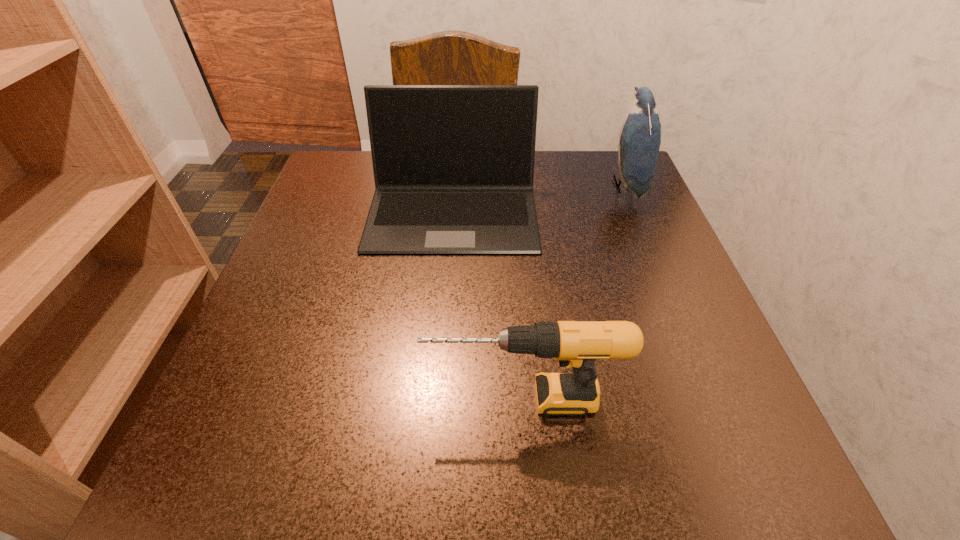
You are a GUI agent. You are given a task and a screenshot of the screen. Output one action in this format:
    pyautogui.click(x=<x>, y=<y>)
    Task: Click on the laptop
    The image size is (960, 540).
    Given the screenshot: What is the action you would take?
    pyautogui.click(x=453, y=165)

This screenshot has width=960, height=540. I want to click on the rightmost object, so click(640, 136).

I want to click on the shortest object, so click(576, 344).

You are a GUI agent. You are given a task and a screenshot of the screen. Output one action in this format:
    pyautogui.click(x=<x>, y=<y>)
    Task: Click on the drill
    This screenshot has width=960, height=540.
    Given the screenshot: What is the action you would take?
    pyautogui.click(x=576, y=344)

At what (x,y) coordinates should I click in order to perform the action: click on vacant region located 0.360m on the screen of the laptop. Please return your answer as a coordinate pair (x, y). The width and height of the screenshot is (960, 540). Looking at the image, I should click on (436, 440).

The height and width of the screenshot is (540, 960). I want to click on vacant space located 0.100m at the tip of the bird's beak, so click(564, 186).

Locate an element on the screen. The image size is (960, 540). vacant area situated 0.050m at the tip of the bird's beak is located at coordinates (587, 186).

The image size is (960, 540). I want to click on blank space located at the tip of the bird's beak, so click(493, 186).

Locate an element on the screen. Image resolution: width=960 pixels, height=540 pixels. blank area located on the handle side of the shortest object is located at coordinates (305, 399).

Locate an element on the screen. vacant space located on the handle side of the shortest object is located at coordinates (249, 399).